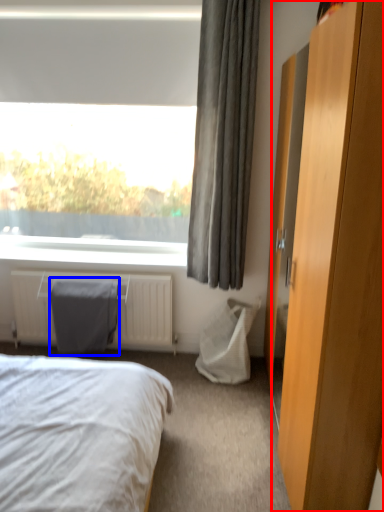
Question: Which of the following is the farthest to the observer, dresser (highlighted by a red box) or gray (highlighted by a blue box)?

Choices:
 (A) dresser
 (B) gray

Answer: (B)